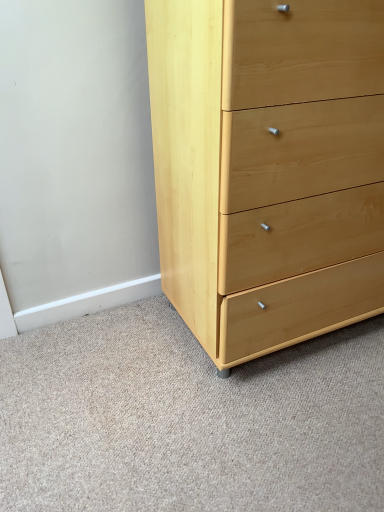
Identify the location of light wood drawer at lower right. This screenshot has height=512, width=384. (188, 419).

In order to face light wood drawer at lower right, should I rotate leftwards or rightwards?

Rotate right and turn 5.233 degrees.

The width and height of the screenshot is (384, 512). Describe the element at coordinates (188, 419) in the screenshot. I see `light wood drawer at lower right` at that location.

Measure the distance between light wood drawer at lower right and camera.

light wood drawer at lower right is 91.88 centimeters from camera.

Measure the distance between point (374,221) and camera.

3.77 feet.

This screenshot has width=384, height=512. In order to click on natural wood chest of drawers at center in this screenshot , I will do `click(268, 168)`.

What do you see at coordinates (268, 168) in the screenshot? This screenshot has width=384, height=512. I see `natural wood chest of drawers at center` at bounding box center [268, 168].

Locate an element on the screen. light wood drawer at lower right is located at coordinates (188, 419).

Visually, is natural wood chest of drawers at center positioned to the left or to the right of light wood drawer at lower right?

natural wood chest of drawers at center is positioned on light wood drawer at lower right's right side.

Is the depth of natural wood chest of drawers at center less than that of light wood drawer at lower right?

No.

Between point (354, 286) and point (62, 346), which one is positioned behind?

The point (62, 346) is farther from the camera.

From the image's perspective, who appears lower, natural wood chest of drawers at center or light wood drawer at lower right?

light wood drawer at lower right is shown below in the image.

From a real-world perspective, does natural wood chest of drawers at center sit lower than light wood drawer at lower right?

No, from a real-world perspective, natural wood chest of drawers at center is not beneath light wood drawer at lower right.

Which of these two, natural wood chest of drawers at center or light wood drawer at lower right, is wider?

Wider between the two is light wood drawer at lower right.

Can you confirm if natural wood chest of drawers at center is shorter than light wood drawer at lower right?

No.

Is natural wood chest of drawers at center bigger or smaller than light wood drawer at lower right?

natural wood chest of drawers at center is bigger than light wood drawer at lower right.

Can light wood drawer at lower right be found inside natural wood chest of drawers at center?

No, light wood drawer at lower right is located outside of natural wood chest of drawers at center.

Is natural wood chest of drawers at center next to light wood drawer at lower right?

No, natural wood chest of drawers at center is not touching light wood drawer at lower right.

Is natural wood chest of drawers at center facing away from light wood drawer at lower right?

No.

Find the location of a particular element. plain below the natural wood chest of drawers at center (from the image's perspective) is located at coordinates (188, 419).

Visually, is light wood drawer at lower right positioned to the left or to the right of natural wood chest of drawers at center?

Based on their positions, light wood drawer at lower right is located to the left of natural wood chest of drawers at center.

Which object is more forward, light wood drawer at lower right or natural wood chest of drawers at center?

light wood drawer at lower right is in front.

Is point (100, 337) positioned after point (181, 258)?

That is True.

From the image's perspective, who appears lower, light wood drawer at lower right or natural wood chest of drawers at center?

light wood drawer at lower right appears lower in the image.

From a real-world perspective, is light wood drawer at lower right physically located above or below natural wood chest of drawers at center?

Clearly, from a real-world perspective, light wood drawer at lower right is below natural wood chest of drawers at center.

Considering the relative sizes of light wood drawer at lower right and natural wood chest of drawers at center in the image provided, is light wood drawer at lower right thinner than natural wood chest of drawers at center?

No, light wood drawer at lower right is not thinner than natural wood chest of drawers at center.

In the scene shown: Which of these two, light wood drawer at lower right or natural wood chest of drawers at center, stands taller?

natural wood chest of drawers at center.

In terms of size, does light wood drawer at lower right appear bigger or smaller than natural wood chest of drawers at center?

Considering their sizes, light wood drawer at lower right takes up less space than natural wood chest of drawers at center.

Consider the image. Does light wood drawer at lower right contain natural wood chest of drawers at center?

That's incorrect, natural wood chest of drawers at center is not inside light wood drawer at lower right.

Is light wood drawer at lower right in contact with natural wood chest of drawers at center?

No, light wood drawer at lower right is not beside natural wood chest of drawers at center.

Looking at this image, is light wood drawer at lower right facing towards natural wood chest of drawers at center?

Yes, light wood drawer at lower right is oriented towards natural wood chest of drawers at center.

What are the coordinates of `the chest of drawers behind the light wood drawer at lower right` in the screenshot? It's located at (268, 168).

The image size is (384, 512). I want to click on the chest of drawers that appears behind the light wood drawer at lower right, so click(x=268, y=168).

The height and width of the screenshot is (512, 384). I want to click on plain that appears on the left of natural wood chest of drawers at center, so (188, 419).